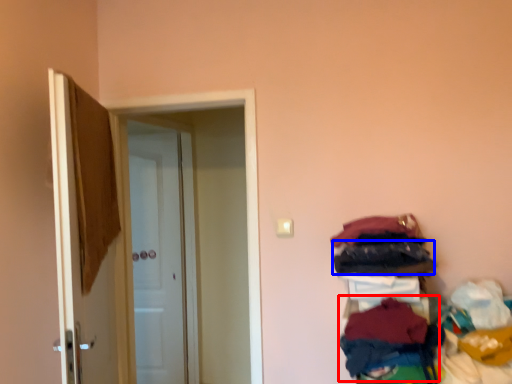
Question: Which point is further to the camera, clothing (highlighted by a red box) or clothing (highlighted by a blue box)?

Choices:
 (A) clothing
 (B) clothing

Answer: (B)